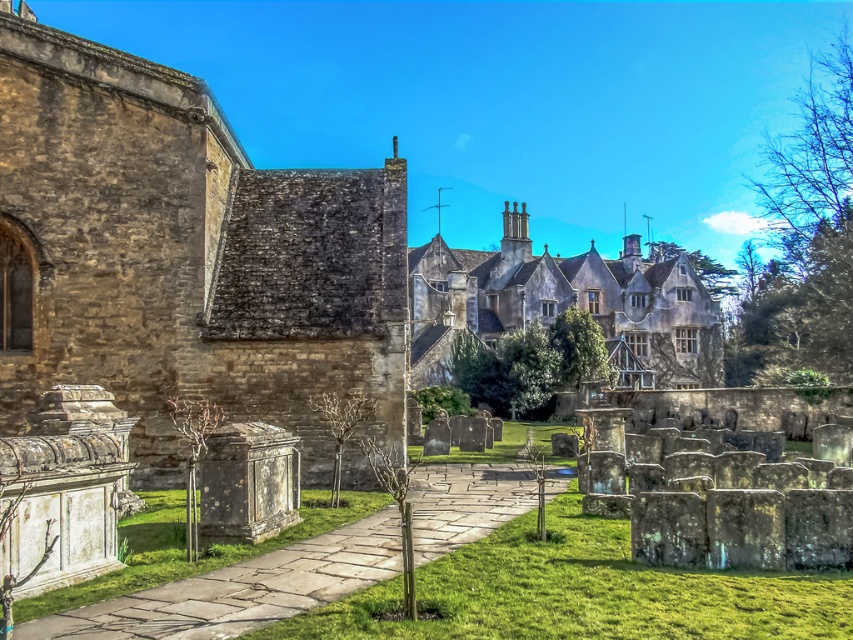
Does stone gray stone building at center appear over green grass at lower left?

Yes.

Does stone gray stone building at center appear on the left side of green grass at lower left?

Incorrect, stone gray stone building at center is not on the left side of green grass at lower left.

Which is in front, point (643, 284) or point (45, 611)?

Point (45, 611) is more forward.

This screenshot has width=853, height=640. I want to click on stone gray stone building at center, so click(569, 301).

Is green grass at center to the left of smooth gray stone gravestone at lower left from the viewer's perspective?

Incorrect, green grass at center is not on the left side of smooth gray stone gravestone at lower left.

Is green grass at center smaller than smooth gray stone gravestone at lower left?

A: Actually, green grass at center might be larger than smooth gray stone gravestone at lower left.

This screenshot has width=853, height=640. I want to click on green grass at center, so click(x=579, y=593).

Is green grass at center shorter than stone gray stone building at center?

Yes, green grass at center is shorter than stone gray stone building at center.

Between green grass at center and stone gray stone building at center, which one has more height?

stone gray stone building at center

Who is more distant from viewer, (590, 516) or (686, 272)?

Point (686, 272)

At what (x,y) coordinates should I click in order to perform the action: click on green grass at center. Please return your answer as a coordinate pair (x, y). Looking at the image, I should click on (579, 593).